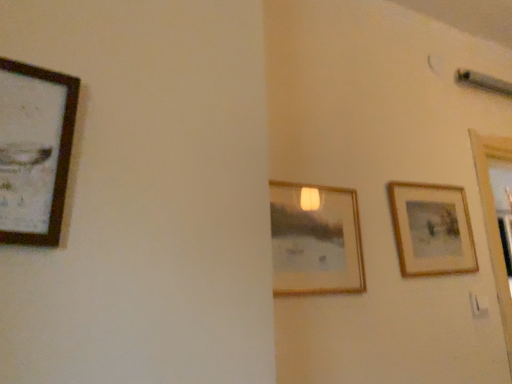
Question: Is wooden framed picture at right, positioned as the third picture frame in left-to-right order, completely or partially inside wooden framed picture at center, acting as the second picture frame starting from the left?

Choices:
 (A) yes
 (B) no

Answer: (B)

Question: Considering the relative sizes of wooden framed picture at center, positioned as the second picture frame in back-to-front order, and wooden framed picture at right, positioned as the 3th picture frame in front-to-back order, in the image provided, is wooden framed picture at center, positioned as the second picture frame in back-to-front order, wider than wooden framed picture at right, positioned as the 3th picture frame in front-to-back order,?

Choices:
 (A) no
 (B) yes

Answer: (B)

Question: From a real-world perspective, is wooden framed picture at center, acting as the second picture frame starting from the left, physically above wooden framed picture at right, which appears as the first picture frame when viewed from the right?

Choices:
 (A) no
 (B) yes

Answer: (A)

Question: Is wooden framed picture at center, arranged as the second picture frame when viewed from the front, bigger than wooden framed picture at right, positioned as the 3th picture frame in front-to-back order?

Choices:
 (A) no
 (B) yes

Answer: (A)

Question: From the image's perspective, is wooden framed picture at center, positioned as the second picture frame in back-to-front order, over wooden framed picture at right, positioned as the third picture frame in left-to-right order?

Choices:
 (A) no
 (B) yes

Answer: (A)

Question: Does wooden framed picture at center, acting as the second picture frame starting from the left, appear on the right side of wooden framed picture at right, acting as the 1th picture frame starting from the back?

Choices:
 (A) yes
 (B) no

Answer: (B)

Question: Could you tell me if wooden framed picture at center, positioned as the second picture frame in back-to-front order, is turned towards wooden framed artwork at left, acting as the 1th picture frame starting from the left?

Choices:
 (A) yes
 (B) no

Answer: (B)

Question: Is wooden framed picture at center, arranged as the second picture frame when viewed from the front, positioned behind wooden framed artwork at left, acting as the 1th picture frame starting from the front?

Choices:
 (A) yes
 (B) no

Answer: (A)

Question: Can you confirm if wooden framed picture at center, positioned as the second picture frame in back-to-front order, is positioned to the right of wooden framed artwork at left, acting as the 1th picture frame starting from the left?

Choices:
 (A) no
 (B) yes

Answer: (B)

Question: Is wooden framed artwork at left, the 3th picture frame viewed from the back, at the back of wooden framed picture at center, acting as the second picture frame starting from the left?

Choices:
 (A) no
 (B) yes

Answer: (A)

Question: Can you confirm if wooden framed picture at center, acting as the second picture frame starting from the left, is positioned to the left of wooden framed artwork at left, which is counted as the 3th picture frame, starting from the right?

Choices:
 (A) yes
 (B) no

Answer: (B)

Question: From a real-world perspective, is wooden framed picture at center, positioned as the second picture frame in back-to-front order, located higher than wooden framed artwork at left, acting as the 1th picture frame starting from the left?

Choices:
 (A) no
 (B) yes

Answer: (A)

Question: Does wooden framed artwork at left, which is counted as the 3th picture frame, starting from the right, have a lesser width compared to wooden framed picture at center, arranged as the second picture frame when viewed from the front?

Choices:
 (A) yes
 (B) no

Answer: (B)